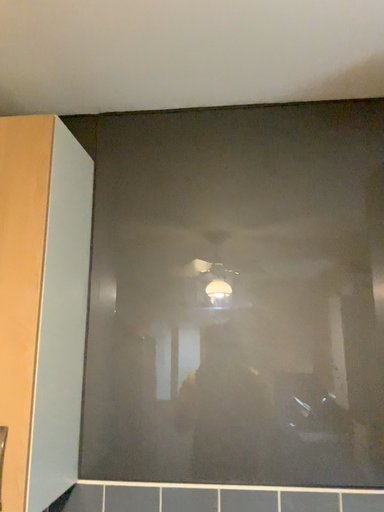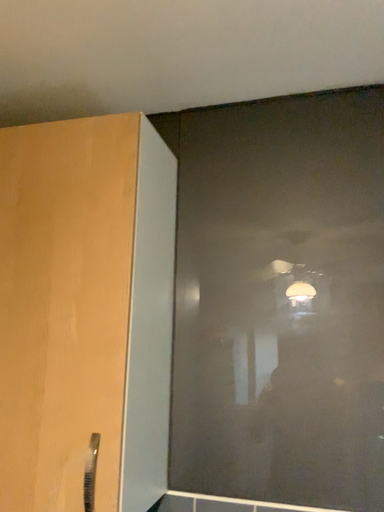
Question: Which way did the camera rotate in the video?

Choices:
 (A) rotated left
 (B) rotated right

Answer: (A)